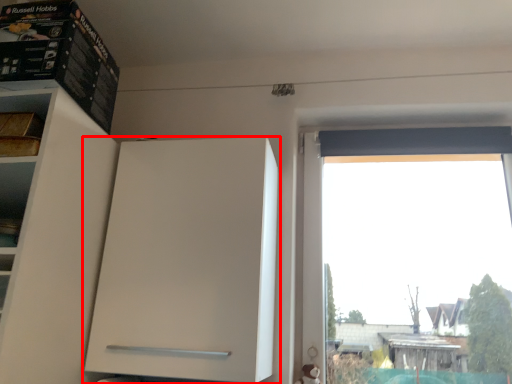
Question: Where is cabinetry (annotated by the red box) located in relation to cabinet in the image?

Choices:
 (A) left
 (B) right

Answer: (B)